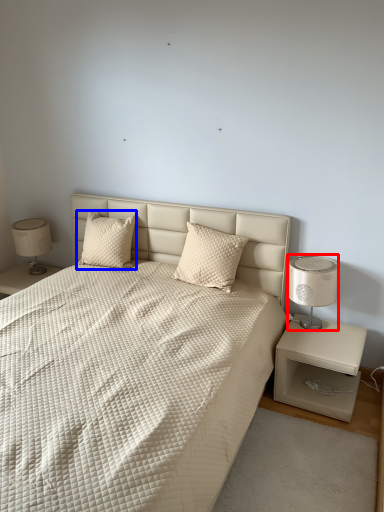
Question: Which of the following is the farthest to the observer, bedside lamp (highlighted by a red box) or pillow (highlighted by a blue box)?

Choices:
 (A) bedside lamp
 (B) pillow

Answer: (B)